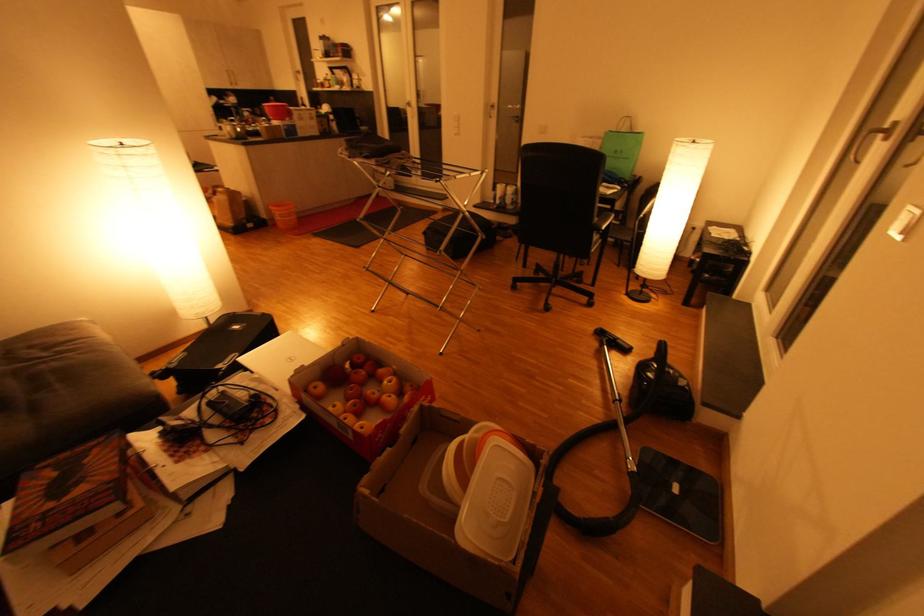
Describe the element at coordinates (51, 370) in the screenshot. I see `the sofa sitting surface` at that location.